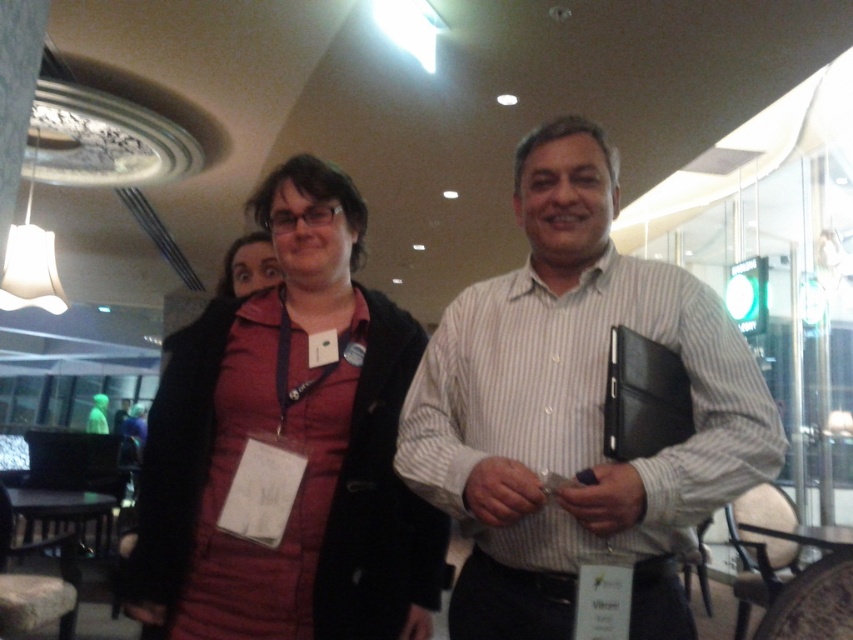
You are organizing a conference and need to retrieve the matte red vest at center for a speaker. However, there is a matte black folder at center blocking access. Can you reach the vest without moving the folder?

The matte black folder at center is positioned over the matte red vest at center, so you cannot reach the vest without moving the folder.

You are at a conference and need to access the name tag on your coat. You see the matte red vest at center and the matte red coat at center. Which one is closer to your upper body?

The matte red vest at center is positioned under the matte red coat at center, so the matte red vest at center is closer to your upper body.